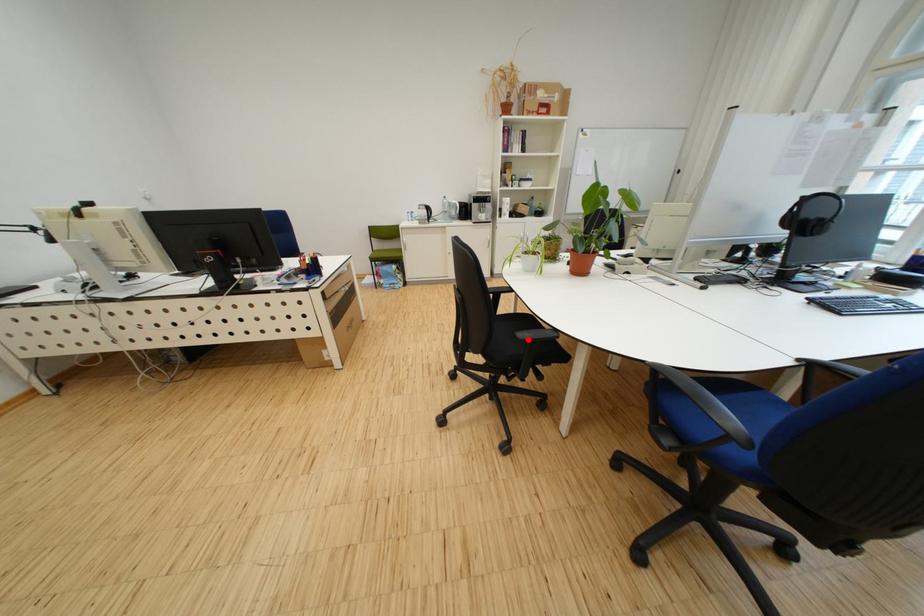
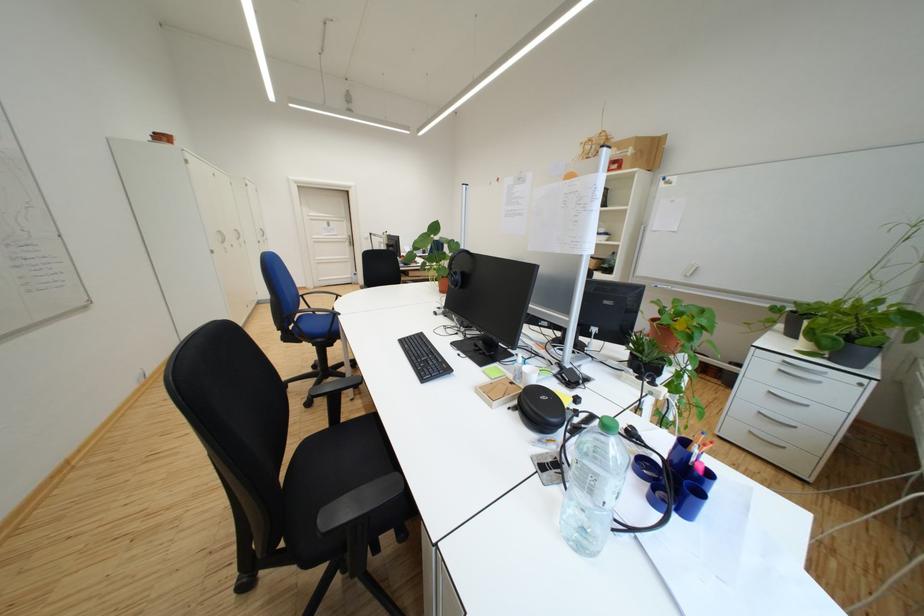
Question: I am providing you with two images of the same scene from different viewpoints. A red point is marked on the first image. Is the red point's position out of view in image 2?

Choices:
 (A) Yes
 (B) No

Answer: (A)